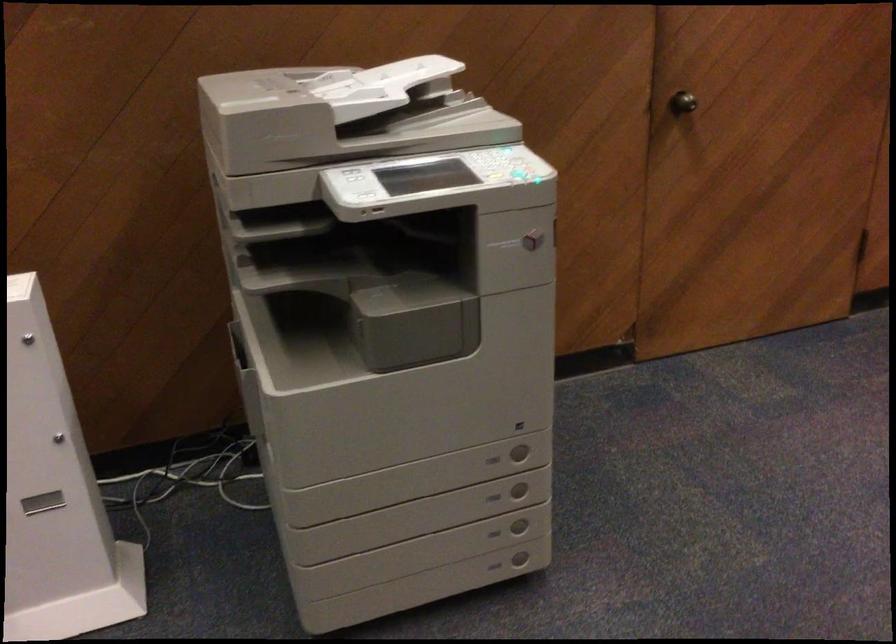
Describe the element at coordinates (682, 102) in the screenshot. I see `a round door knob` at that location.